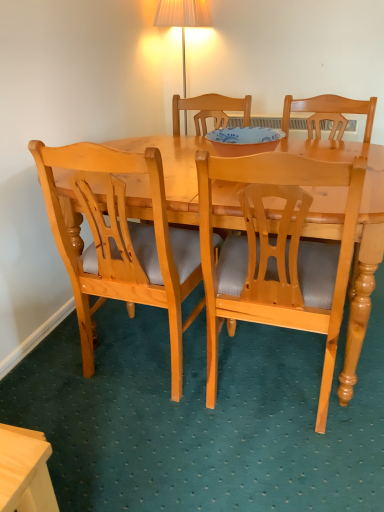
Question: Considering the positions of blue glossy bowl at center and light brown wood chair at center, which is the first chair in right-to-left order, in the image, is blue glossy bowl at center wider or thinner than light brown wood chair at center, which is the first chair in right-to-left order,?

Choices:
 (A) thin
 (B) wide

Answer: (A)

Question: Visually, is blue glossy bowl at center positioned to the left or to the right of light brown wood chair at center, which is the first chair in right-to-left order?

Choices:
 (A) left
 (B) right

Answer: (A)

Question: Which is farther from the blue glossy bowl at center?

Choices:
 (A) light brown wood chair at left, the 2th chair in the right-to-left sequence
 (B) light wood desk at lower left
 (C) light brown wood chair at center, which is the first chair in right-to-left order

Answer: (B)

Question: Which object is positioned farthest from the light wood desk at lower left?

Choices:
 (A) light brown wood chair at left, marked as the first chair in a left-to-right arrangement
 (B) blue glossy bowl at center
 (C) light brown wood chair at center, which is the first chair in right-to-left order

Answer: (B)